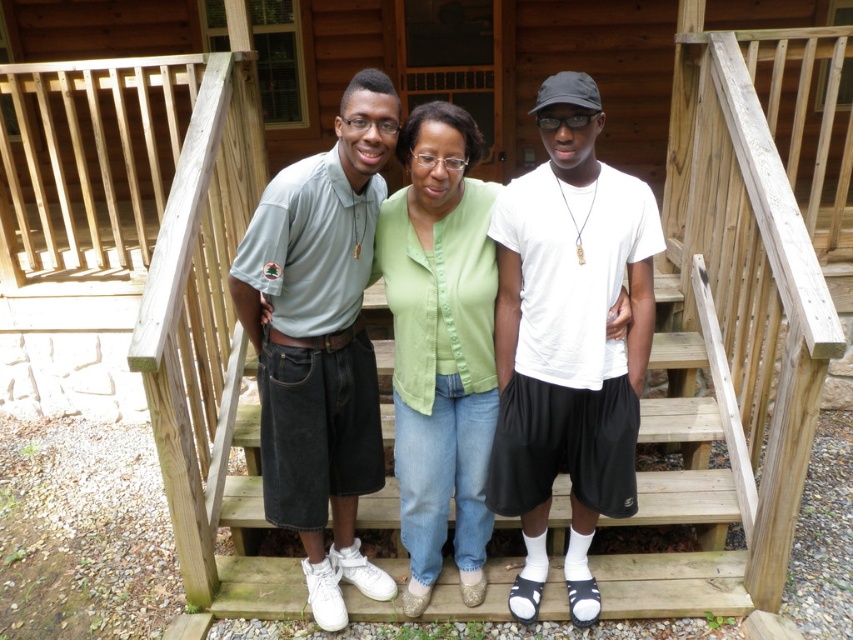
Question: Which object is positioned farthest from the light gray polo shirt at center?

Choices:
 (A) matte green shirt at center
 (B) white matte t-shirt at center

Answer: (B)

Question: Is white matte t-shirt at center to the left of green fabric shirt at center from the viewer's perspective?

Choices:
 (A) no
 (B) yes

Answer: (A)

Question: Which is farther from the green fabric shirt at center?

Choices:
 (A) light gray polo shirt at center
 (B) white matte t-shirt at center

Answer: (A)

Question: Is matte green shirt at center smaller than green fabric shirt at center?

Choices:
 (A) no
 (B) yes

Answer: (A)

Question: Which object is farther from the camera taking this photo?

Choices:
 (A) green fabric shirt at center
 (B) light gray polo shirt at center

Answer: (A)

Question: Does white matte t-shirt at center have a greater width compared to matte green shirt at center?

Choices:
 (A) no
 (B) yes

Answer: (A)